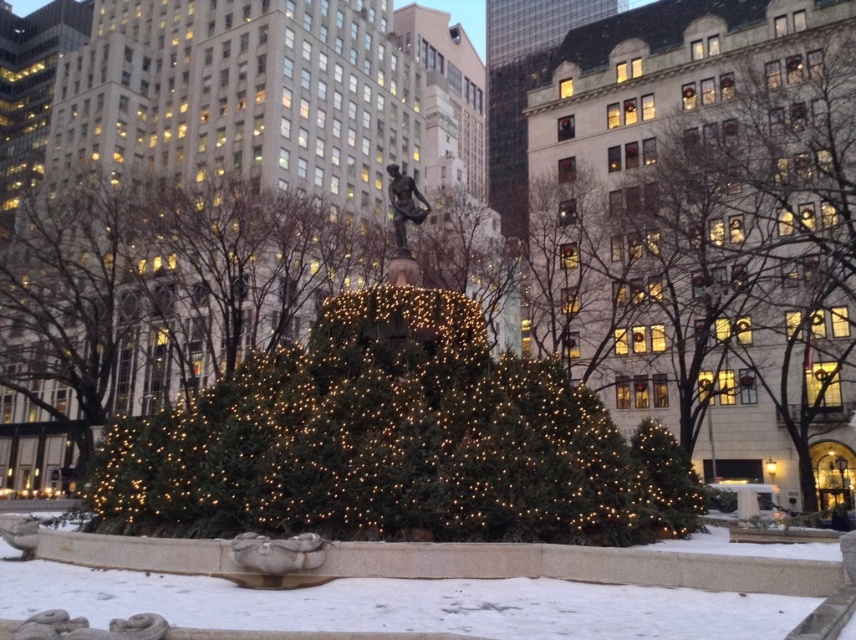
Question: Observing the image, what is the correct spatial positioning of green matte christmas tree at center in reference to white snow at center?

Choices:
 (A) above
 (B) below

Answer: (A)

Question: Can you confirm if green matte christmas tree at center is smaller than white snow at center?

Choices:
 (A) no
 (B) yes

Answer: (A)

Question: Among these points, which one is nearest to the camera?

Choices:
 (A) (587, 392)
 (B) (712, 560)

Answer: (B)

Question: Does green matte christmas tree at center appear on the left side of white snow at center?

Choices:
 (A) no
 (B) yes

Answer: (B)